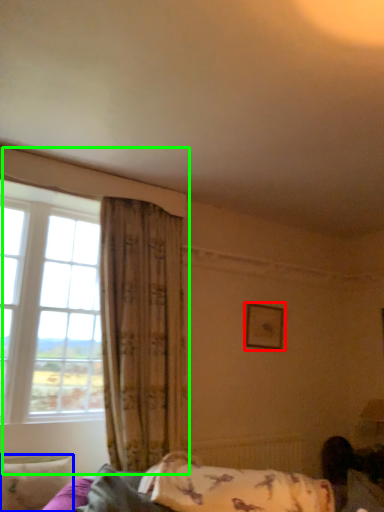
Question: Which is farther away from picture frame (highlighted by a red box)? pillow (highlighted by a blue box) or window (highlighted by a green box)?

Choices:
 (A) pillow
 (B) window

Answer: (A)